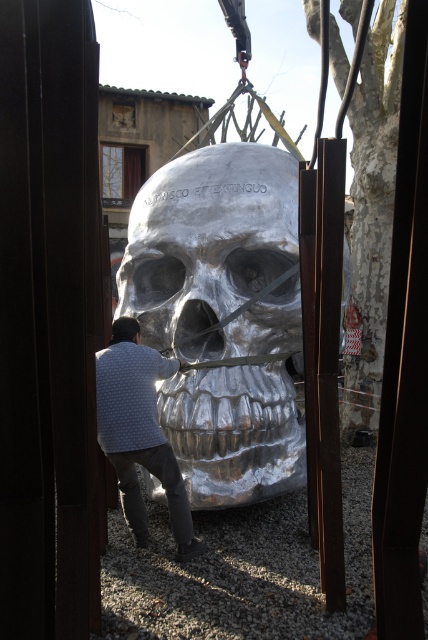
Question: Is shiny silver skull at center to the left of white dotted sweater at center from the viewer's perspective?

Choices:
 (A) no
 (B) yes

Answer: (A)

Question: Can you confirm if shiny silver skull at center is wider than white dotted sweater at center?

Choices:
 (A) yes
 (B) no

Answer: (A)

Question: Which object is closer to the camera taking this photo?

Choices:
 (A) white dotted sweater at center
 (B) shiny silver skull at center

Answer: (A)

Question: Does shiny silver skull at center have a smaller size compared to white dotted sweater at center?

Choices:
 (A) no
 (B) yes

Answer: (A)